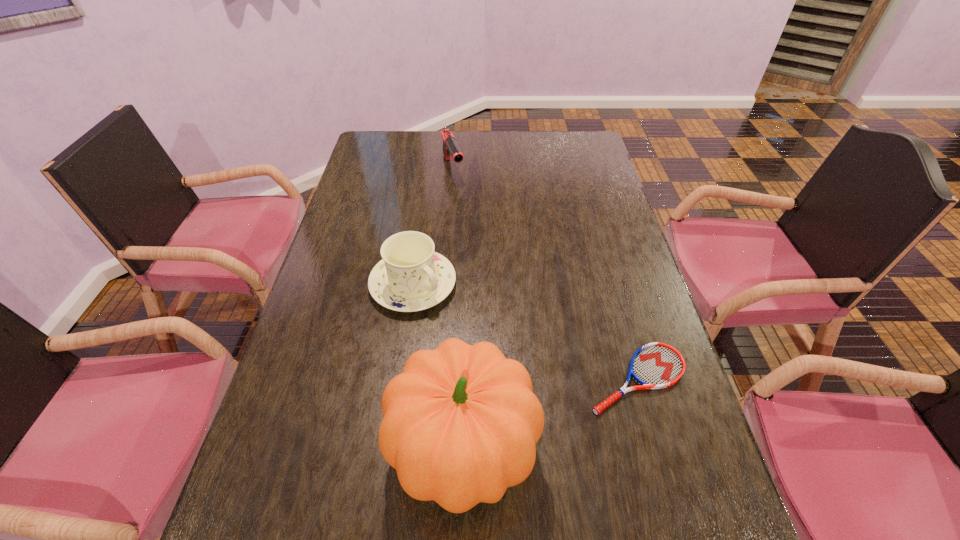
Image resolution: width=960 pixels, height=540 pixels. What are the coordinates of `vacant space at the right edge` in the screenshot? It's located at (595, 229).

At what (x,y) coordinates should I click in order to perform the action: click on vacant space at the far left corner of the desktop. Please return your answer as a coordinate pair (x, y). Looking at the image, I should click on (376, 154).

At what (x,y) coordinates should I click in order to perform the action: click on unoccupied position between the farthest object and the tallest object. Please return your answer as a coordinate pair (x, y). Looking at the image, I should click on (459, 309).

You are a GUI agent. You are given a task and a screenshot of the screen. Output one action in this format:
    pyautogui.click(x=<x>, y=<y>)
    Task: Click on the unoccupied position between the tallest object and the tennis racket
    Image resolution: width=960 pixels, height=540 pixels.
    Given the screenshot: What is the action you would take?
    pyautogui.click(x=550, y=415)

At what (x,y) coordinates should I click in order to perform the action: click on vacant point located between the chinaware and the rightmost object. Please return your answer as a coordinate pair (x, y). Looking at the image, I should click on (525, 332).

The height and width of the screenshot is (540, 960). I want to click on empty space between the tallest object and the gun, so click(x=459, y=309).

Where is `free spot between the third nearest object and the gun`? The width and height of the screenshot is (960, 540). free spot between the third nearest object and the gun is located at coordinates (433, 227).

Where is `vacant space in between the tennis racket and the tallest object`? vacant space in between the tennis racket and the tallest object is located at coordinates (550, 415).

Locate an element on the screen. The height and width of the screenshot is (540, 960). vacant space in between the chinaware and the farthest object is located at coordinates (433, 227).

Locate an element on the screen. Image resolution: width=960 pixels, height=540 pixels. vacant space that is in between the shortest object and the gun is located at coordinates (545, 274).